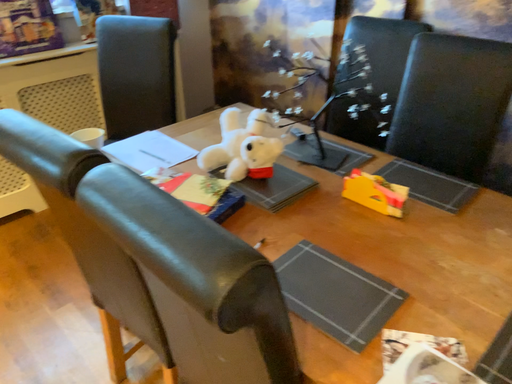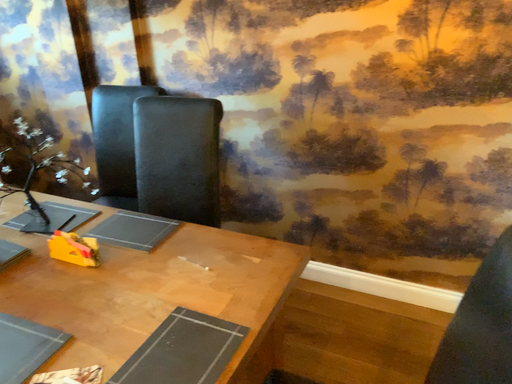
Question: Which way did the camera rotate in the video?

Choices:
 (A) rotated upward
 (B) rotated downward

Answer: (A)